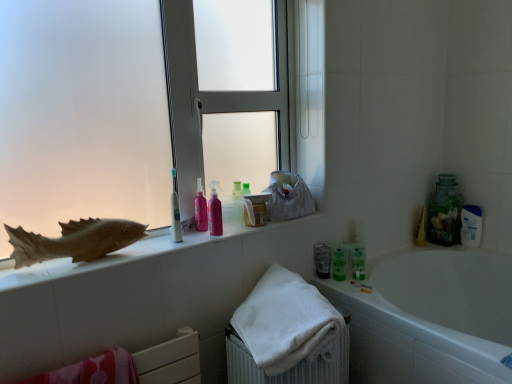
This screenshot has width=512, height=384. In order to click on space that is in front of green translucent bottle at lower center, the first toiletry when ordered from bottom to top in this screenshot , I will do `click(359, 287)`.